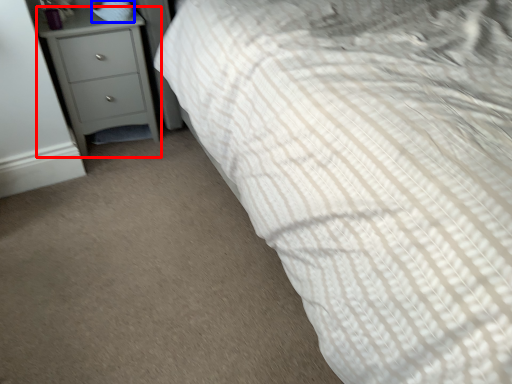
Question: Which point is closer to the camera, chest of drawers (highlighted by a red box) or pillow (highlighted by a blue box)?

Choices:
 (A) chest of drawers
 (B) pillow

Answer: (A)